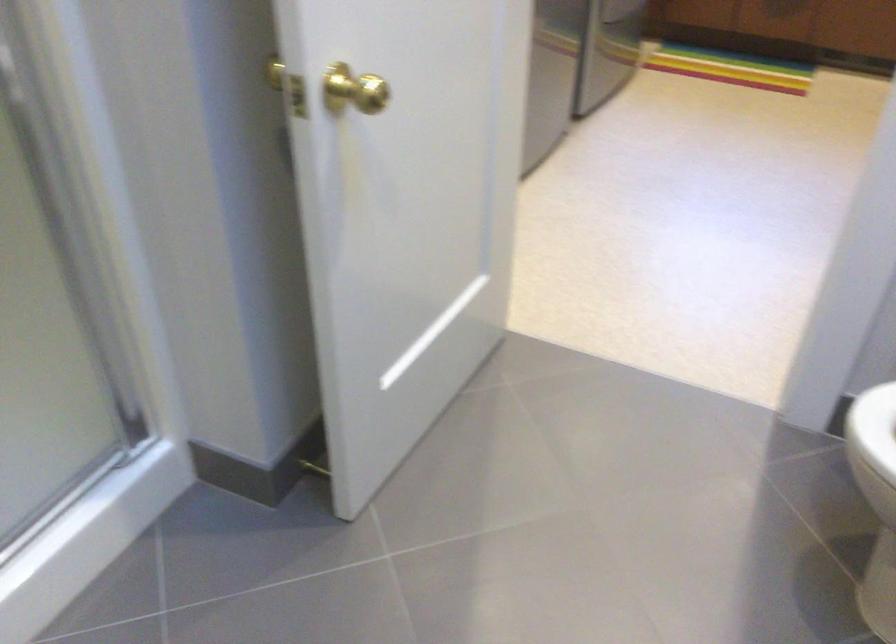
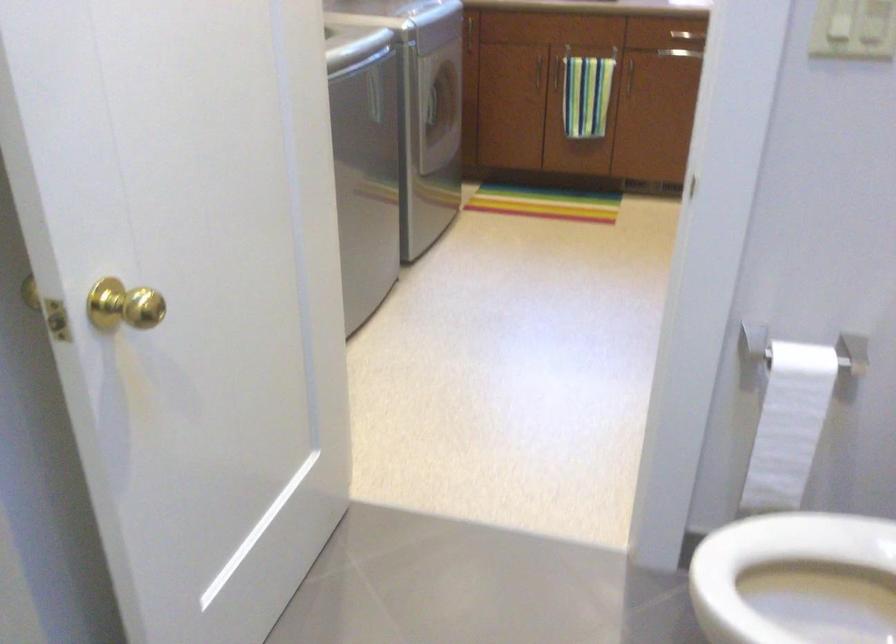
Question: Based on the continuous images, in which direction is the camera rotating? Reply with the corresponding letter.

Choices:
 (A) Left
 (B) Right
 (C) Up
 (D) Down

Answer: (B)